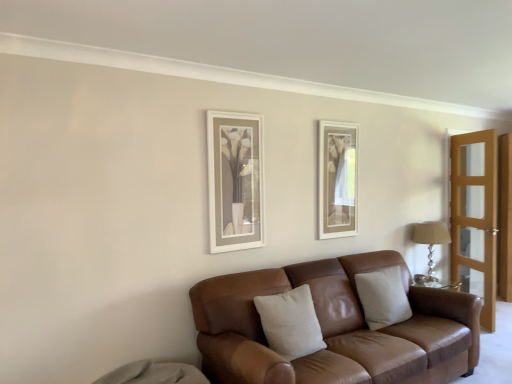
Question: Does beige cotton pillow at center, which is the 1th pillow in front-to-back order, have a lesser width compared to brown leather couch at center?

Choices:
 (A) no
 (B) yes

Answer: (B)

Question: Considering the relative sizes of beige cotton pillow at center, the 1th pillow when ordered from left to right, and brown leather couch at center in the image provided, is beige cotton pillow at center, the 1th pillow when ordered from left to right, taller than brown leather couch at center?

Choices:
 (A) no
 (B) yes

Answer: (A)

Question: From the image's perspective, would you say beige cotton pillow at center, which is the 1th pillow in front-to-back order, is positioned over brown leather couch at center?

Choices:
 (A) no
 (B) yes

Answer: (B)

Question: From a real-world perspective, is beige cotton pillow at center, which is the 1th pillow in front-to-back order, physically above brown leather couch at center?

Choices:
 (A) yes
 (B) no

Answer: (A)

Question: Does beige cotton pillow at center, positioned as the 2th pillow in back-to-front order, have a greater width compared to brown leather couch at center?

Choices:
 (A) no
 (B) yes

Answer: (A)

Question: Relative to light brown wooden screen door at right, is brown leather couch at center in front or behind?

Choices:
 (A) behind
 (B) front

Answer: (B)

Question: Considering the positions of brown leather couch at center and light brown wooden screen door at right in the image, is brown leather couch at center bigger or smaller than light brown wooden screen door at right?

Choices:
 (A) small
 (B) big

Answer: (B)

Question: Would you say brown leather couch at center is inside or outside light brown wooden screen door at right?

Choices:
 (A) outside
 (B) inside

Answer: (A)

Question: From the image's perspective, relative to light brown wooden screen door at right, is brown leather couch at center above or below?

Choices:
 (A) below
 (B) above

Answer: (A)

Question: Is silver glass table lamp at right in front of or behind brown leather couch at center in the image?

Choices:
 (A) behind
 (B) front

Answer: (A)

Question: From their relative heights in the image, would you say silver glass table lamp at right is taller or shorter than brown leather couch at center?

Choices:
 (A) tall
 (B) short

Answer: (B)

Question: Is silver glass table lamp at right wider or thinner than brown leather couch at center?

Choices:
 (A) wide
 (B) thin

Answer: (B)

Question: From the image's perspective, is silver glass table lamp at right positioned above or below brown leather couch at center?

Choices:
 (A) below
 (B) above

Answer: (B)

Question: Based on their sizes in the image, would you say beige leather pillow at center, marked as the second pillow in a front-to-back arrangement, is bigger or smaller than silver glass table lamp at right?

Choices:
 (A) big
 (B) small

Answer: (A)

Question: Considering the positions of beige leather pillow at center, marked as the second pillow in a front-to-back arrangement, and silver glass table lamp at right in the image, is beige leather pillow at center, marked as the second pillow in a front-to-back arrangement, wider or thinner than silver glass table lamp at right?

Choices:
 (A) thin
 (B) wide

Answer: (A)